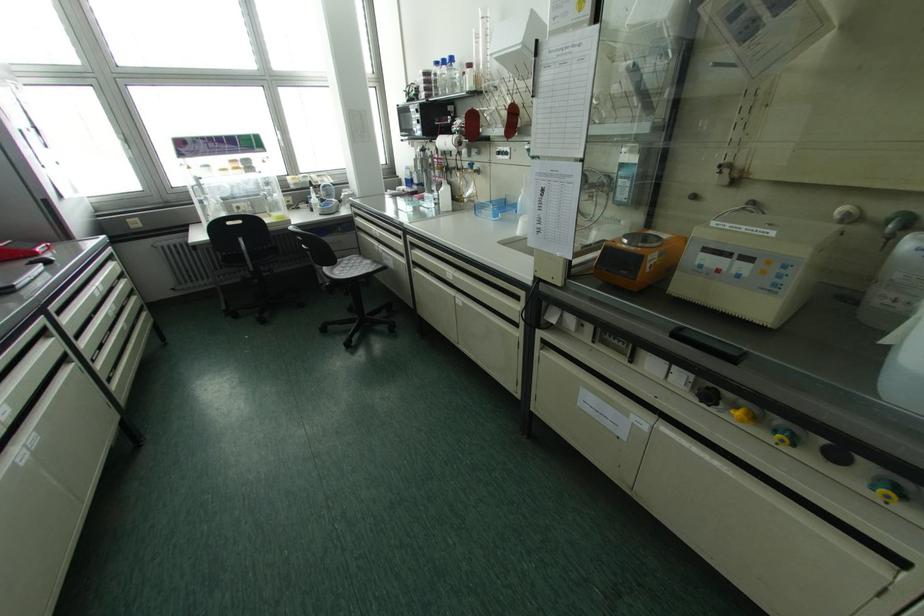
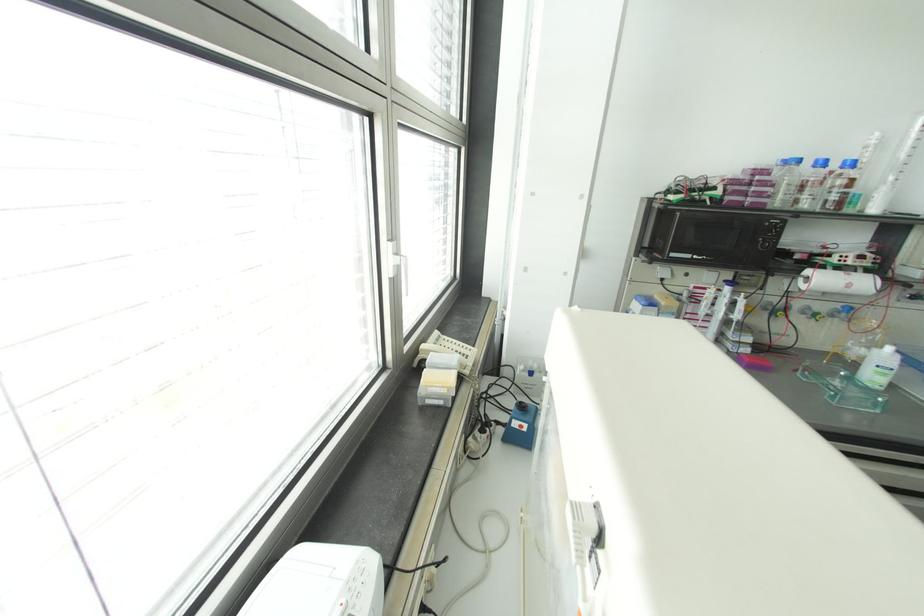
Find the pixel in the second image that matches the point at 435,63 in the first image.

(797, 160)